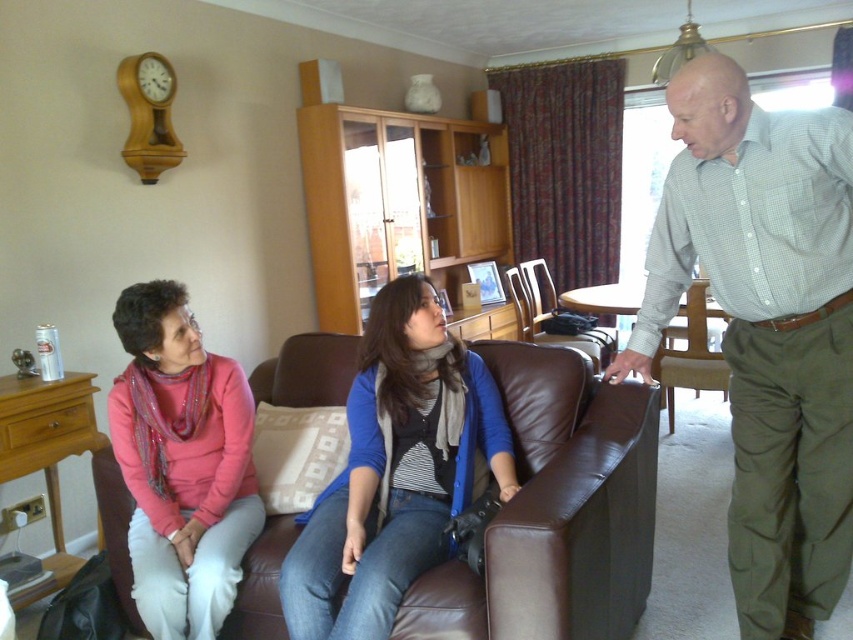
Who is more distant from viewer, (560, 432) or (659, 356)?

Positioned behind is point (659, 356).

Which is below, brown leather couch at center or brown leather chair at right?

brown leather couch at center is lower down.

Where is `brown leather couch at center`? Image resolution: width=853 pixels, height=640 pixels. brown leather couch at center is located at coordinates (556, 512).

Where is `brown leather couch at center`? This screenshot has width=853, height=640. brown leather couch at center is located at coordinates (556, 512).

Which is in front, point (790, 522) or point (607, 410)?

Point (790, 522) is more forward.

Can you confirm if green checkered shirt at right is shorter than brown leather couch at center?

In fact, green checkered shirt at right may be taller than brown leather couch at center.

At what (x,y) coordinates should I click in order to perform the action: click on green checkered shirt at right. Please return your answer as a coordinate pair (x, y). This screenshot has width=853, height=640. Looking at the image, I should click on (766, 328).

Who is more forward, (833, 397) or (672, 372)?

Point (833, 397) is in front.

Is green checkered shirt at right shorter than brown leather chair at right?

Incorrect, green checkered shirt at right's height does not fall short of brown leather chair at right's.

Does point (758, 236) come closer to viewer compared to point (674, 362)?

Yes, point (758, 236) is in front of point (674, 362).

At what (x,y) coordinates should I click in order to perform the action: click on green checkered shirt at right. Please return your answer as a coordinate pair (x, y). The height and width of the screenshot is (640, 853). Looking at the image, I should click on (766, 328).